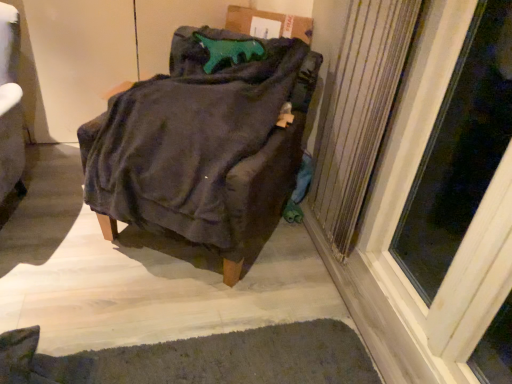
Question: Is velvety dark gray chair at center at the left side of transparent glass screen door at right?

Choices:
 (A) no
 (B) yes

Answer: (B)

Question: Is transparent glass screen door at right at the back of velvety dark gray chair at center?

Choices:
 (A) yes
 (B) no

Answer: (B)

Question: Is transparent glass screen door at right completely or partially inside velvety dark gray chair at center?

Choices:
 (A) no
 (B) yes

Answer: (A)

Question: Can you confirm if velvety dark gray chair at center is taller than transparent glass screen door at right?

Choices:
 (A) yes
 (B) no

Answer: (B)

Question: Can you confirm if velvety dark gray chair at center is wider than transparent glass screen door at right?

Choices:
 (A) no
 (B) yes

Answer: (B)

Question: From a real-world perspective, is velvety dark gray chair at center positioned over transparent glass screen door at right based on gravity?

Choices:
 (A) yes
 (B) no

Answer: (B)

Question: Does velvety dark gray chair at center appear on the right side of metallic silver radiator at right?

Choices:
 (A) no
 (B) yes

Answer: (A)

Question: Is velvety dark gray chair at center not close to metallic silver radiator at right?

Choices:
 (A) yes
 (B) no

Answer: (B)

Question: Is velvety dark gray chair at center thinner than metallic silver radiator at right?

Choices:
 (A) yes
 (B) no

Answer: (B)

Question: From a real-world perspective, is velvety dark gray chair at center physically below metallic silver radiator at right?

Choices:
 (A) no
 (B) yes

Answer: (B)

Question: Considering the relative positions of velvety dark gray chair at center and metallic silver radiator at right in the image provided, is velvety dark gray chair at center to the left of metallic silver radiator at right from the viewer's perspective?

Choices:
 (A) no
 (B) yes

Answer: (B)

Question: Is the depth of velvety dark gray chair at center greater than that of metallic silver radiator at right?

Choices:
 (A) yes
 (B) no

Answer: (B)

Question: Does metallic silver radiator at right have a greater height compared to dark gray textured mat at lower center?

Choices:
 (A) yes
 (B) no

Answer: (A)